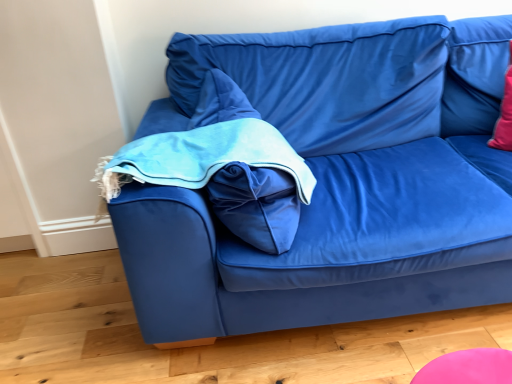
Question: Is velvet blue bean bag chair at center-left taller than velvet blue couch at center?

Choices:
 (A) no
 (B) yes

Answer: (A)

Question: Can you confirm if velvet blue bean bag chair at center-left is wider than velvet blue couch at center?

Choices:
 (A) yes
 (B) no

Answer: (B)

Question: Does velvet blue bean bag chair at center-left come behind velvet blue couch at center?

Choices:
 (A) yes
 (B) no

Answer: (A)

Question: Is velvet blue bean bag chair at center-left facing away from velvet blue couch at center?

Choices:
 (A) yes
 (B) no

Answer: (A)

Question: From a real-world perspective, is velvet blue bean bag chair at center-left on top of velvet blue couch at center?

Choices:
 (A) yes
 (B) no

Answer: (A)

Question: From the image's perspective, is velvet blue bean bag chair at center-left on velvet blue couch at center?

Choices:
 (A) no
 (B) yes

Answer: (A)

Question: From the image's perspective, is velvet blue couch at center located above velvet blue bean bag chair at center-left?

Choices:
 (A) no
 (B) yes

Answer: (B)

Question: Can we say velvet blue couch at center lies outside velvet blue bean bag chair at center-left?

Choices:
 (A) no
 (B) yes

Answer: (B)

Question: Is the depth of velvet blue couch at center greater than that of velvet blue bean bag chair at center-left?

Choices:
 (A) yes
 (B) no

Answer: (B)

Question: Considering the relative sizes of velvet blue couch at center and velvet blue bean bag chair at center-left in the image provided, is velvet blue couch at center taller than velvet blue bean bag chair at center-left?

Choices:
 (A) yes
 (B) no

Answer: (A)

Question: Is the depth of velvet blue couch at center less than that of velvet blue bean bag chair at center-left?

Choices:
 (A) no
 (B) yes

Answer: (B)

Question: Is velvet blue couch at center to the right of velvet blue bean bag chair at center-left from the viewer's perspective?

Choices:
 (A) yes
 (B) no

Answer: (A)

Question: Considering their positions, is velvet blue couch at center located in front of or behind velvet blue bean bag chair at center-left?

Choices:
 (A) front
 (B) behind

Answer: (A)